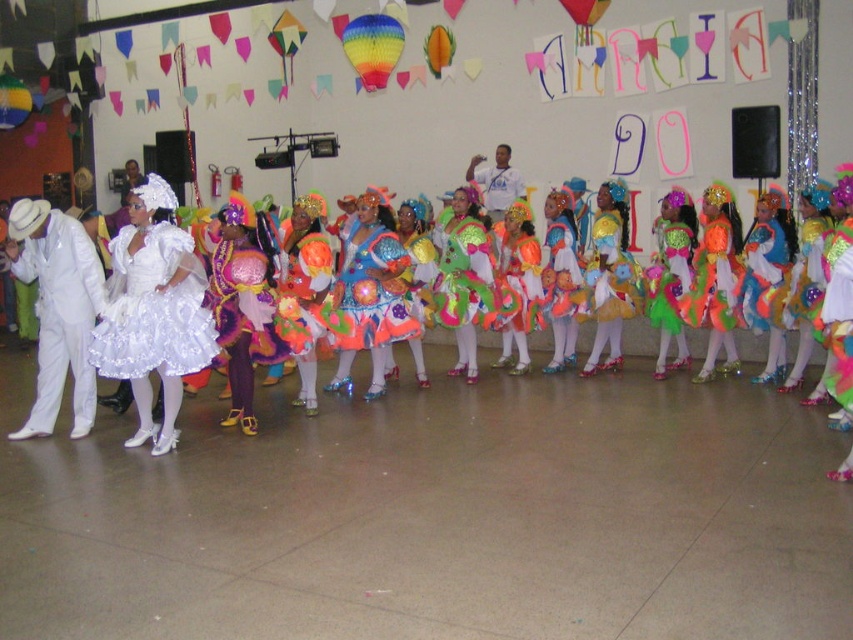
You are a photographer at this event and want to capture a photo of the white satin suit at left and the rainbow paper balloon at upper left. Since you can only focus on one object, which one should you choose to ensure it appears larger in the photo?

The white satin suit at left is larger in size than the rainbow paper balloon at upper left, so focusing on the white satin suit at left will ensure it appears larger in the photo.

You are standing at the point marked as point (48, 237) in the image. You want to walk to the exit door located at the opposite side of the room. The shortest path requires moving straight ahead. Considering the distance between you and the viewer, is it feasible to walk directly to the exit without obstacles?

The distance between point (48, 237) and the viewer is 21.72 feet. Since the shortest path is straight ahead and there are no obstacles mentioned in the scene description, it is feasible to walk directly to the exit.